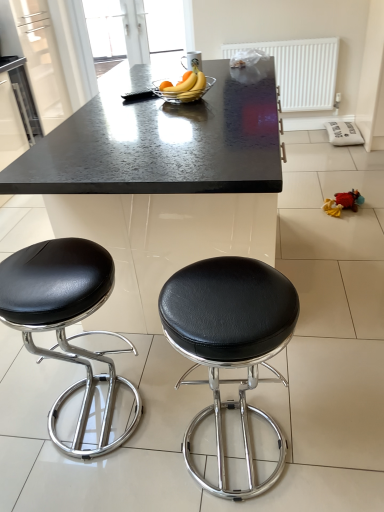
At what (x,y) coordinates should I click in order to perform the action: click on free space above black leather stool at center, placed as the first stool when sorted from right to left (from a real-world perspective). Please return your answer as a coordinate pair (x, y). This screenshot has height=512, width=384. Looking at the image, I should click on (229, 293).